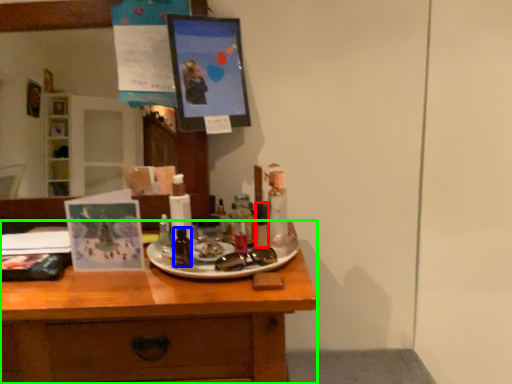
Question: Which object is the farthest from toiletry (highlighted by a red box)? Choose among these: toiletry (highlighted by a blue box) or desk (highlighted by a green box).

Choices:
 (A) toiletry
 (B) desk

Answer: (B)